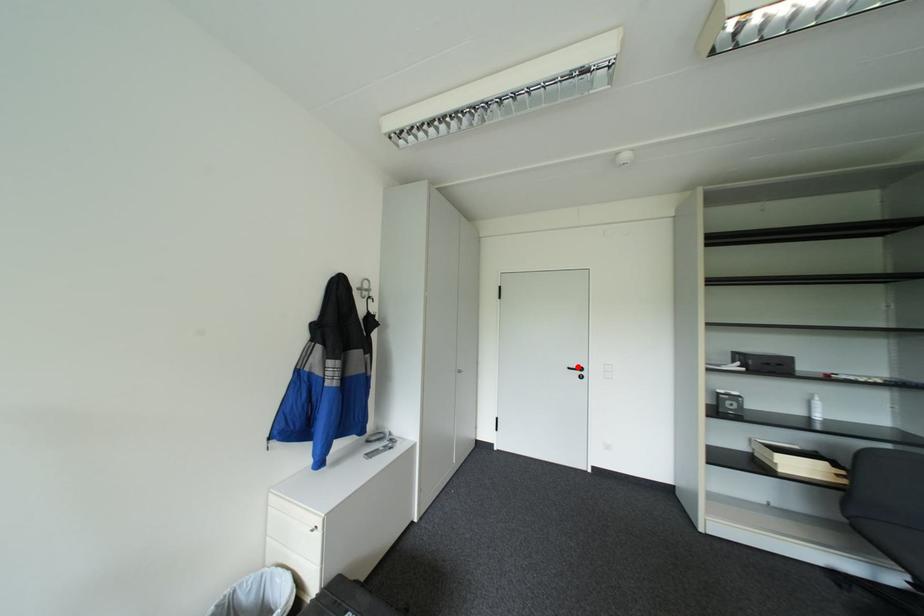
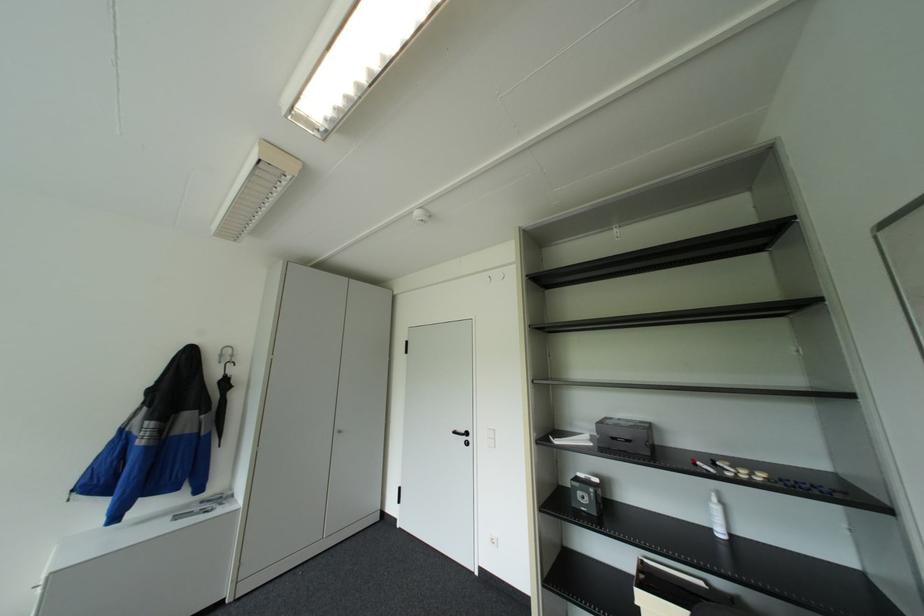
The point at the highlighted location is marked in the first image. Where is the corresponding point in the second image?

(463, 431)